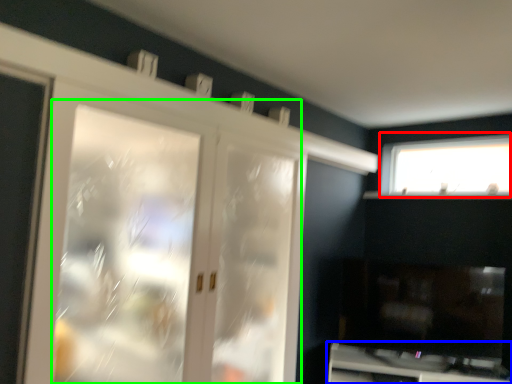
Question: Considering the real-world distances, which object is closest to window (highlighted by a red box)? cabinetry (highlighted by a blue box) or screen door (highlighted by a green box).

Choices:
 (A) cabinetry
 (B) screen door

Answer: (A)